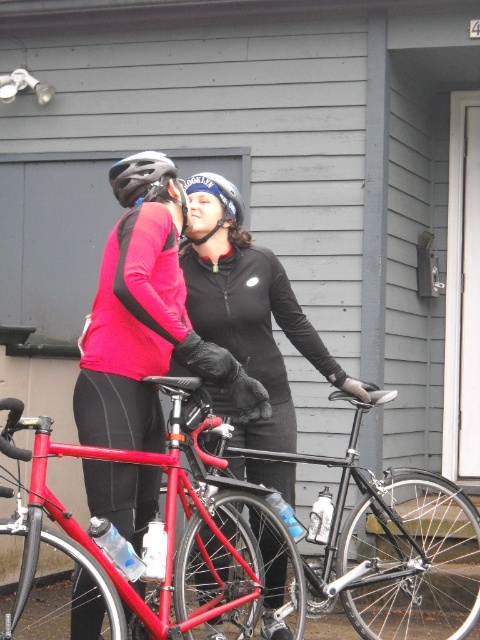
Measure the distance between point (142, 497) and camera.

Point (142, 497) and camera are 14.33 feet apart from each other.

Between matte black jacket at center and matte black helmet at center, which one has more height?

With more height is matte black jacket at center.

This screenshot has height=640, width=480. In order to click on matte black jacket at center in this screenshot , I will do `click(145, 333)`.

Is shiny red frame bicycle at center to the left of matte black helmet at center from the viewer's perspective?

In fact, shiny red frame bicycle at center is to the right of matte black helmet at center.

The width and height of the screenshot is (480, 640). In order to click on shiny red frame bicycle at center in this screenshot , I will do `click(252, 538)`.

The image size is (480, 640). I want to click on shiny red frame bicycle at center, so click(x=252, y=538).

How far apart are matte black jacket at center and black matte jacket at center?

matte black jacket at center is 18.36 inches away from black matte jacket at center.

Does point (175, 278) come closer to viewer compared to point (239, 266)?

Yes, point (175, 278) is in front of point (239, 266).

You are a GUI agent. You are given a task and a screenshot of the screen. Output one action in this format:
    pyautogui.click(x=<x>, y=<y>)
    Task: Click on the matte black jacket at center
    The height and width of the screenshot is (640, 480).
    Given the screenshot: What is the action you would take?
    pyautogui.click(x=145, y=333)